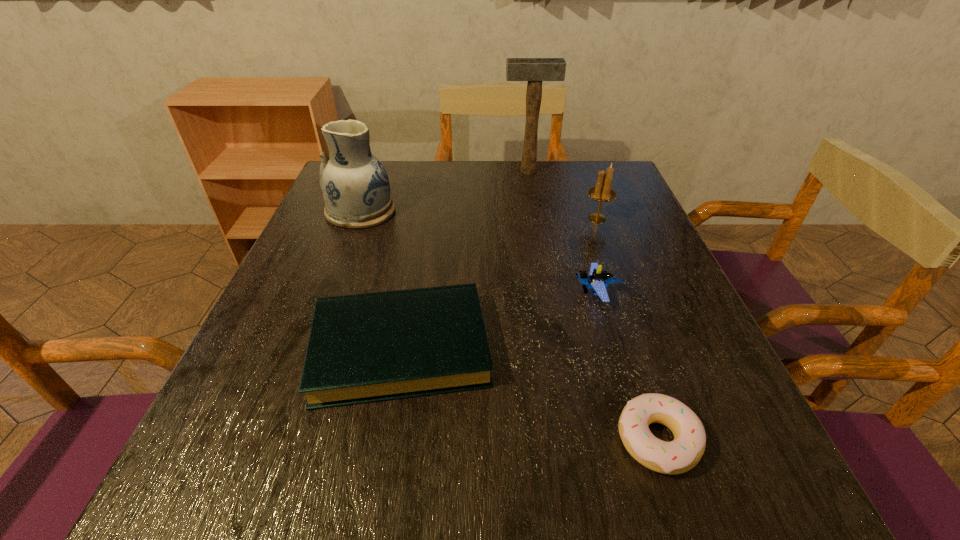
Identify which object is the third nearest to the second tallest object. Please provide its 2D coordinates. Your answer should be formatted as a tuple, i.e. [(x, y)], where the tuple contains the x and y coordinates of a point satisfying the conditions above.

[(598, 279)]

Find the location of `object that can be found as the closest to the pottery`. object that can be found as the closest to the pottery is located at coordinates pyautogui.click(x=369, y=347).

At what (x,y) coordinates should I click in order to perform the action: click on vacant space that satisfies the following two spatial constraints: 1. on the front-facing side of the fourth tallest object; 2. on the front side of the book. Please return your answer as a coordinate pair (x, y). Looking at the image, I should click on (612, 348).

Where is `vacant area that satisfies the following two spatial constraints: 1. on the front side of the mallet; 2. on the left side of the candle holder`? vacant area that satisfies the following two spatial constraints: 1. on the front side of the mallet; 2. on the left side of the candle holder is located at coordinates (536, 219).

Locate an element on the screen. The width and height of the screenshot is (960, 540). free point that satisfies the following two spatial constraints: 1. on the back side of the book; 2. on the left side of the fourth shortest object is located at coordinates [x=423, y=219].